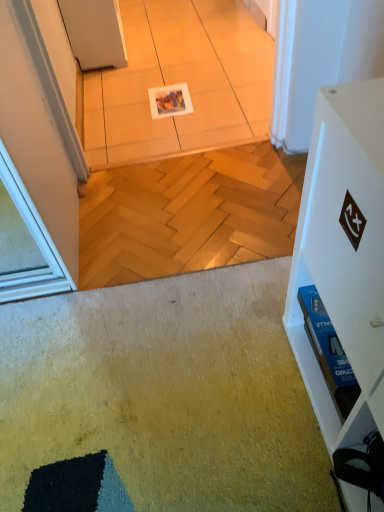
The image size is (384, 512). What do you see at coordinates (181, 82) in the screenshot? I see `white glossy tile at center` at bounding box center [181, 82].

What are the coordinates of `white glossy tile at center` in the screenshot? It's located at (181, 82).

What is the approximate height of white glossy tile at center?

white glossy tile at center is 2.33 inches tall.

Where is `white matte cabinet at right`? The width and height of the screenshot is (384, 512). white matte cabinet at right is located at coordinates (343, 253).

The width and height of the screenshot is (384, 512). What do you see at coordinates (343, 253) in the screenshot?
I see `white matte cabinet at right` at bounding box center [343, 253].

Locate an element on the screen. white glossy tile at center is located at coordinates (181, 82).

In the scene shown: Based on their positions, is white glossy tile at center located to the left or right of white matte cabinet at right?

Clearly, white glossy tile at center is on the left of white matte cabinet at right in the image.

Which is behind, white glossy tile at center or white matte cabinet at right?

white glossy tile at center.

Is point (239, 130) closer or farther from the camera than point (361, 339)?

Point (239, 130) appears to be farther away from the viewer than point (361, 339).

From the image's perspective, between white glossy tile at center and white matte cabinet at right, who is located below?

white matte cabinet at right is shown below in the image.

From a real-world perspective, who is located lower, white glossy tile at center or white matte cabinet at right?

white glossy tile at center is physically lower.

Between white glossy tile at center and white matte cabinet at right, which one has larger width?

With larger width is white glossy tile at center.

In the scene shown: Is white glossy tile at center taller or shorter than white matte cabinet at right?

white glossy tile at center is shorter than white matte cabinet at right.

Can you confirm if white glossy tile at center is smaller than white matte cabinet at right?

Yes, white glossy tile at center is smaller than white matte cabinet at right.

Is white glossy tile at center located outside white matte cabinet at right?

Yes.

Is the surface of white glossy tile at center in direct contact with white matte cabinet at right?

white glossy tile at center is not next to white matte cabinet at right, and they're not touching.

Could you tell me if white glossy tile at center is turned towards white matte cabinet at right?

No, white glossy tile at center is not turned towards white matte cabinet at right.

This screenshot has width=384, height=512. What are the coordinates of `furniture below the white glossy tile at center (from the image's perspective)` in the screenshot? It's located at (343, 253).

Between white matte cabinet at right and white glossy tile at center, which one appears on the left side from the viewer's perspective?

Positioned to the left is white glossy tile at center.

Is white matte cabinet at right closer to camera compared to white glossy tile at center?

Yes, it is.

Is point (377, 362) farther from camera compared to point (147, 56)?

No, it is in front of (147, 56).

Based on the photo, from the image's perspective, is white matte cabinet at right above or below white glossy tile at center?

white matte cabinet at right is situated lower than white glossy tile at center in the image.

From a real-world perspective, is white matte cabinet at right located beneath white glossy tile at center?

No.

Between white matte cabinet at right and white glossy tile at center, which one has smaller width?

white matte cabinet at right.

Can you confirm if white matte cabinet at right is shorter than white glossy tile at center?

No.

Does white matte cabinet at right have a smaller size compared to white glossy tile at center?

No.

Is white matte cabinet at right inside the boundaries of white glossy tile at center, or outside?

white matte cabinet at right is located beyond the bounds of white glossy tile at center.

Is there a large distance between white matte cabinet at right and white glossy tile at center?

Yes, white matte cabinet at right is far from white glossy tile at center.

Is white matte cabinet at right oriented away from white glossy tile at center?

No, white matte cabinet at right is not facing the opposite direction of white glossy tile at center.

How different are the orientations of white matte cabinet at right and white glossy tile at center in degrees?

89.8 degrees.

This screenshot has width=384, height=512. What are the coordinates of `furniture that is in front of the white glossy tile at center` in the screenshot? It's located at (343, 253).

Where is `furniture positioned vertically above the white glossy tile at center (from a real-world perspective)`? furniture positioned vertically above the white glossy tile at center (from a real-world perspective) is located at coordinates (343, 253).

Find the location of a particular element. This screenshot has width=384, height=512. furniture that appears below the white glossy tile at center (from the image's perspective) is located at coordinates (343, 253).